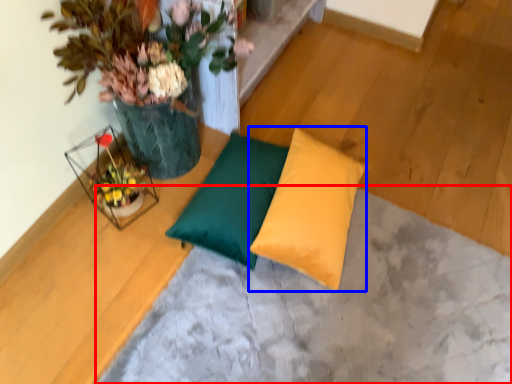
Question: Which object is further to the camera taking this photo, concrete (highlighted by a red box) or pillow (highlighted by a blue box)?

Choices:
 (A) concrete
 (B) pillow

Answer: (B)